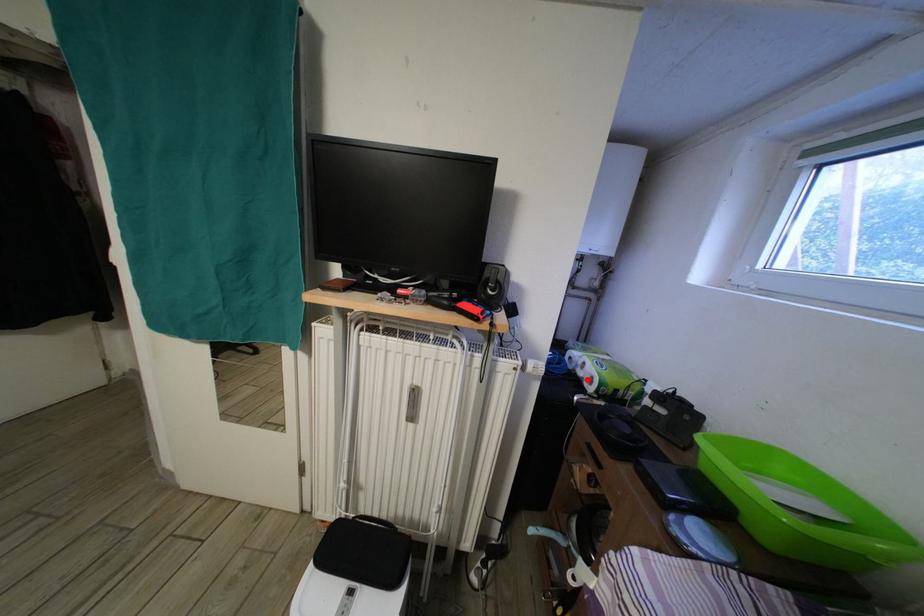
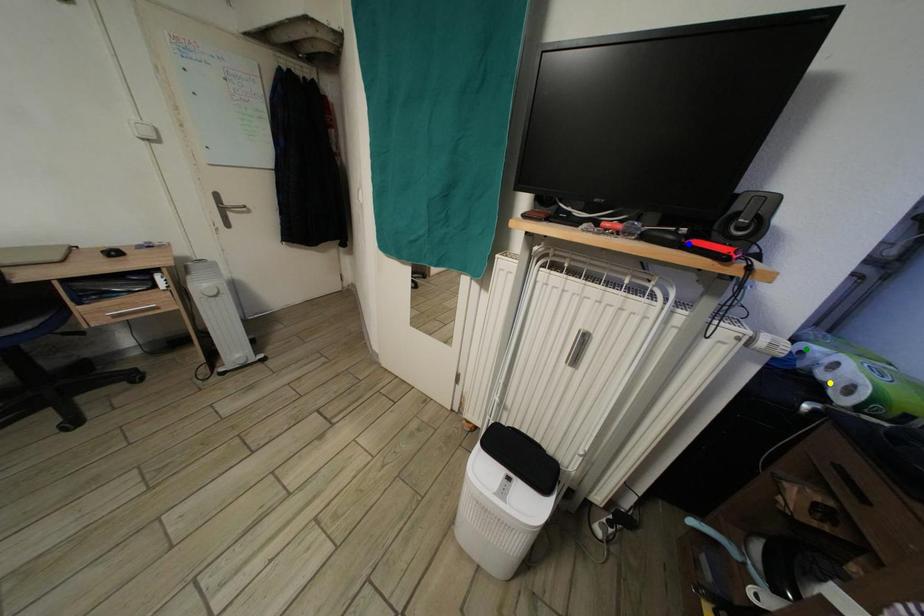
Question: I am providing you with two images of the same scene from different viewpoints. A red point is marked on the first image. You are given multiple points on the second image. Which point in image 2 is actually the same real-world point as the red point in image 1?

Choices:
 (A) green point
 (B) blue point
 (C) yellow point

Answer: (C)